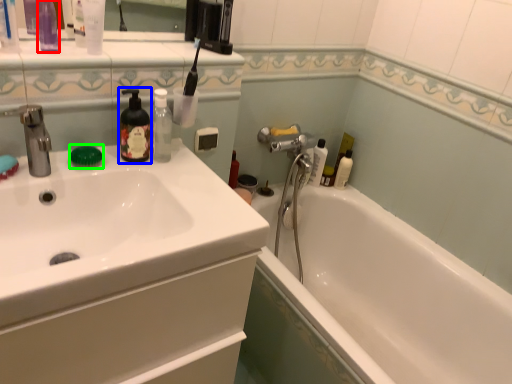
Question: Estimate the real-world distances between objects in this image. Which object is closer to toiletry (highlighted by a red box), soap dispenser (highlighted by a blue box) or soap (highlighted by a green box)?

Choices:
 (A) soap dispenser
 (B) soap

Answer: (A)